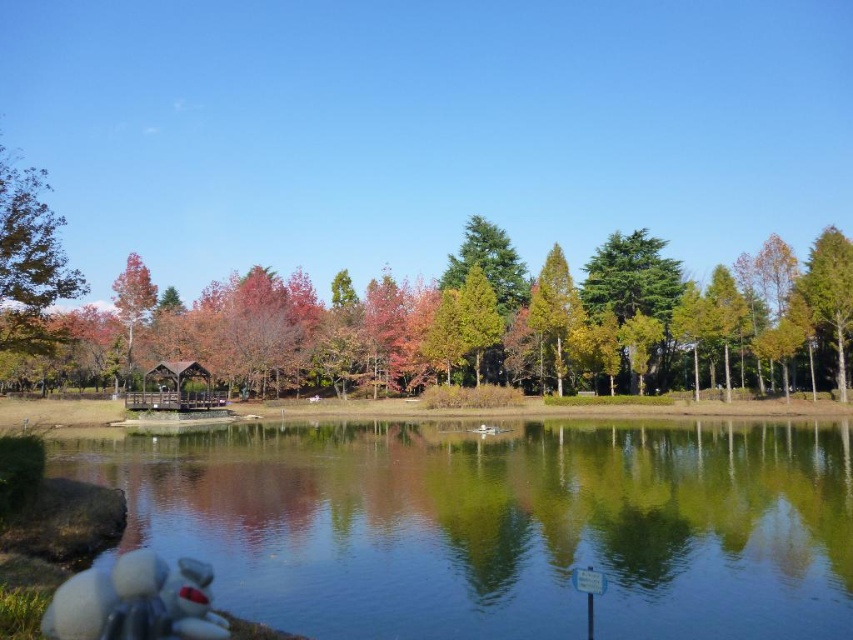
Based on the photo, you are standing in the park and want to take a photo of the clear glass water at lower left. Based on its position, where should you stand relative to the gazebo to capture it in your shot?

The clear glass water at lower left is located at point (500, 524), so you should position yourself to the left side of the gazebo to capture it in your photo.